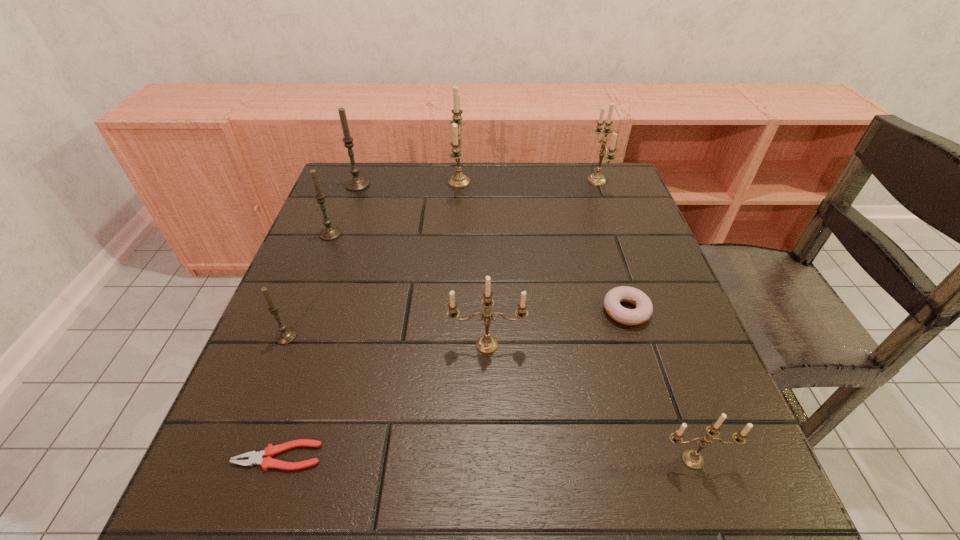
Locate an element on the screen. The width and height of the screenshot is (960, 540). the tallest object is located at coordinates (458, 180).

Where is `the biggest metallic candle`? the biggest metallic candle is located at coordinates (458, 180).

Find the location of a particular element. the second biggest metallic candle is located at coordinates (597, 178).

Where is `the biggest gray candle`? the biggest gray candle is located at coordinates (356, 183).

You are a GUI agent. You are given a task and a screenshot of the screen. Output one action in this format:
    pyautogui.click(x=<x>, y=<y>)
    Task: Click on the second nearest gray candle
    This screenshot has height=540, width=960.
    Given the screenshot: What is the action you would take?
    pyautogui.click(x=329, y=232)

This screenshot has height=540, width=960. What are the coordinates of `the second biggest gray candle` in the screenshot? It's located at (329, 232).

Identify the location of the second smallest metallic candle. The image size is (960, 540). (486, 344).

Locate an element on the screen. Image resolution: width=960 pixels, height=540 pixels. the smallest gray candle is located at coordinates (284, 336).

I want to click on the smallest metallic candle, so click(691, 458).

The width and height of the screenshot is (960, 540). I want to click on the nearest candle, so click(691, 458).